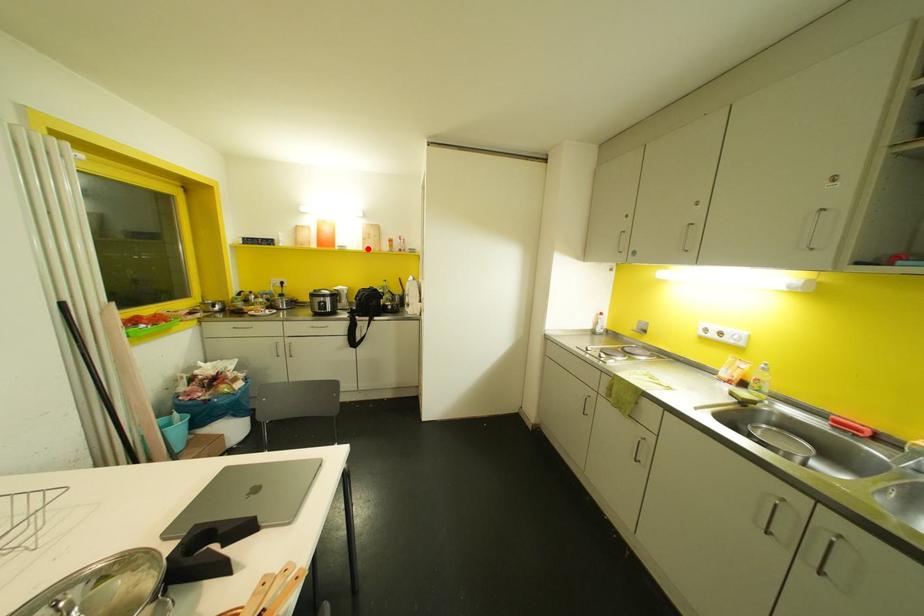
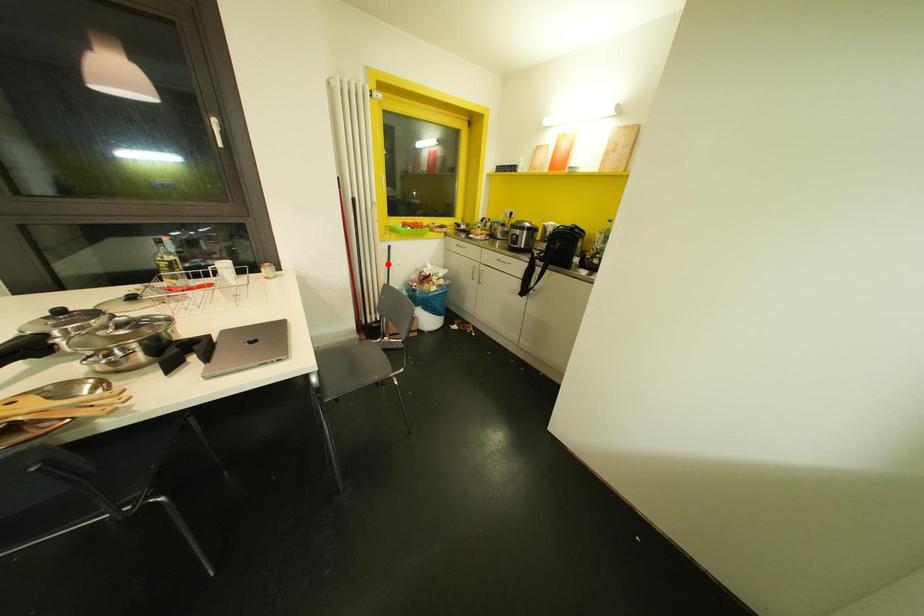
I am providing you with two images of the same scene from different viewpoints. A red point is marked on the first image and another point is marked on the second image. Does the point marked in image1 correspond to the same location as the one in image2?

No